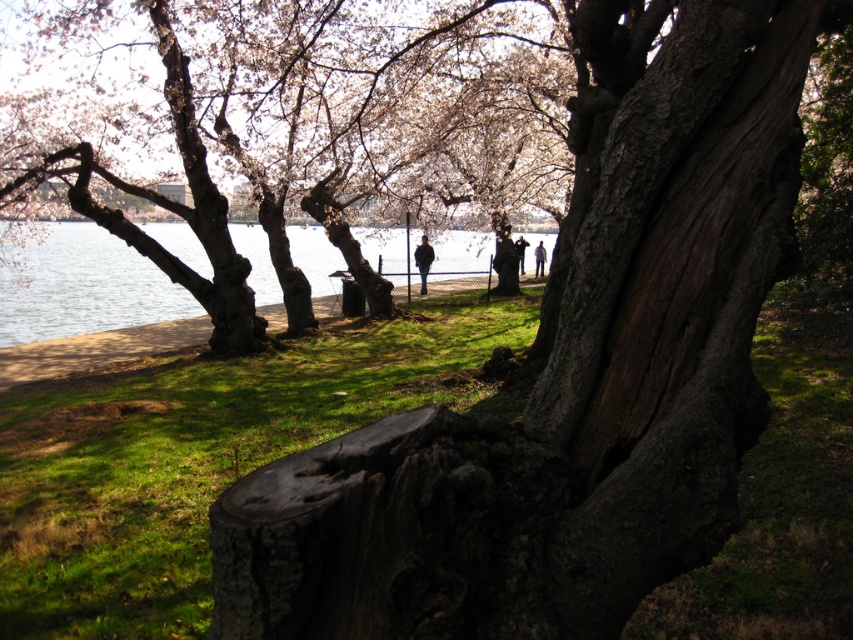
Is green grass at lower left thinner than clear water at center?

Correct, green grass at lower left's width is less than clear water at center's.

Between green grass at lower left and clear water at center, which one appears on the right side from the viewer's perspective?

From the viewer's perspective, green grass at lower left appears more on the right side.

Identify the location of green grass at lower left. (202, 456).

This screenshot has width=853, height=640. I want to click on green grass at lower left, so click(x=202, y=456).

Between point (490, 221) and point (68, 250), which one is positioned behind?

Positioned behind is point (68, 250).

Is the position of smooth bark tree at center more distant than that of clear water at center?

That is False.

Is point (436, 131) in front of point (74, 324)?

Yes, point (436, 131) is in front of point (74, 324).

The height and width of the screenshot is (640, 853). I want to click on smooth bark tree at center, so click(x=329, y=132).

Is green grass at lower left positioned before smooth bark tree at center?

Yes, green grass at lower left is in front of smooth bark tree at center.

Does green grass at lower left appear over smooth bark tree at center?

Incorrect, green grass at lower left is not positioned above smooth bark tree at center.

Where is `green grass at lower left`? The height and width of the screenshot is (640, 853). green grass at lower left is located at coordinates (202, 456).